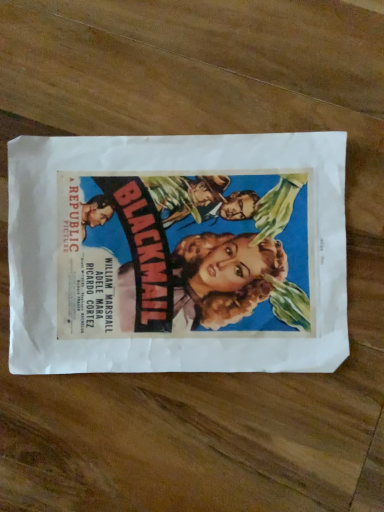
Identify the location of vacant area on top of matte paper poster at center (from a real-world perspective). The image size is (384, 512). (173, 256).